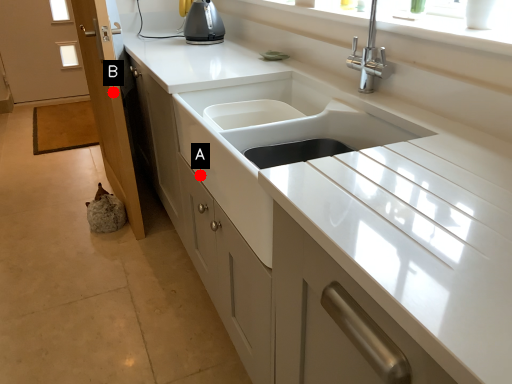
Question: Two points are circled on the image, labeled by A and B beside each circle. Which of the following is the closest to the observer?

Choices:
 (A) A is closer
 (B) B is closer

Answer: (A)